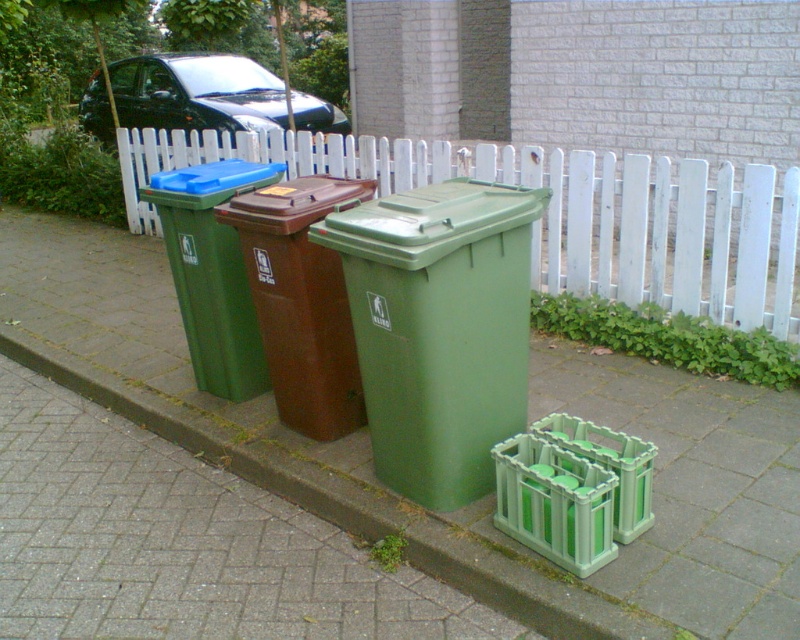
You are standing at the point labeled point (136, 340) and want to walk to the curb. The curb is 15.38 feet away from your current position. If you walk straight towards the curb, will you step on any of the recycling bins placed on the sidewalk?

The distance between point (136, 340) and the curb is 15.38 feet. Since the recycling bins are placed on the sidewalk between your current position and the curb, you would likely step on them if you walk straight towards the curb. However, the exact path depends on their arrangement, but according to the given information, the distance is direct, so you might encounter the bins along the way.

You are standing on the sidewalk near the recycling bins and want to move from the green plastic crate to the curb. Which point should you step on first, point (716, 497) or point (152, 163)?

You should step on point (716, 497) first because it is in front of point (152, 163), meaning it is closer to your starting position near the green plastic crate.

You are a delivery person who needs to place a large package on the sidewalk. The package is the size of the brown matte recycling bin at center. Can you place it on the green plastic pavement at center without moving any existing objects?

The green plastic pavement at center is smaller than the brown matte recycling bin at center. Since the package is the size of the brown matte recycling bin at center, it cannot fit on the green plastic pavement at center because the pavement is smaller in size.